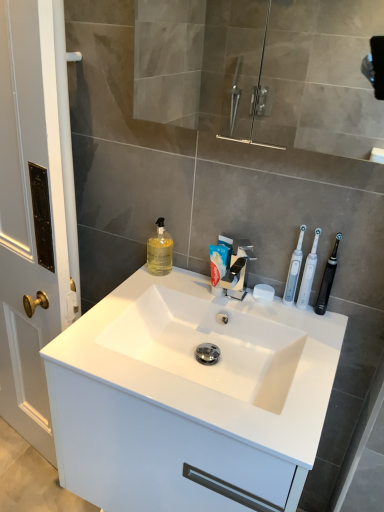
The width and height of the screenshot is (384, 512). Identify the location of free region on the left part of white plastic toothbrush at right, the second toothbrush positioned from the left. (250, 304).